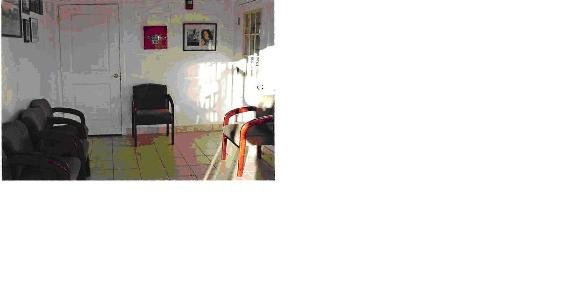
Find the location of a particular element. The height and width of the screenshot is (294, 576). door with window is located at coordinates (245, 41).